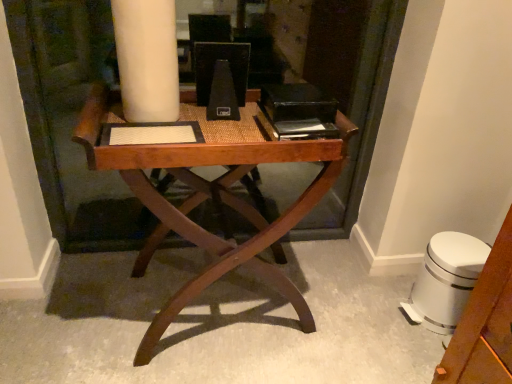
Question: Considering the relative positions of white plastic swivel chair at lower right and wooden desk at center in the image provided, is white plastic swivel chair at lower right behind wooden desk at center?

Choices:
 (A) no
 (B) yes

Answer: (B)

Question: Is wooden desk at center located within white plastic swivel chair at lower right?

Choices:
 (A) no
 (B) yes

Answer: (A)

Question: From the image's perspective, is white plastic swivel chair at lower right beneath wooden desk at center?

Choices:
 (A) yes
 (B) no

Answer: (A)

Question: From the image's perspective, is white plastic swivel chair at lower right on wooden desk at center?

Choices:
 (A) yes
 (B) no

Answer: (B)

Question: Is white plastic swivel chair at lower right thinner than wooden desk at center?

Choices:
 (A) no
 (B) yes

Answer: (B)

Question: Is white plastic swivel chair at lower right looking in the opposite direction of wooden desk at center?

Choices:
 (A) no
 (B) yes

Answer: (A)

Question: Is wooden desk at center aimed at white plastic swivel chair at lower right?

Choices:
 (A) yes
 (B) no

Answer: (B)

Question: Can you confirm if wooden desk at center is thinner than white plastic swivel chair at lower right?

Choices:
 (A) yes
 (B) no

Answer: (B)

Question: From the image's perspective, is wooden desk at center located above white plastic swivel chair at lower right?

Choices:
 (A) yes
 (B) no

Answer: (A)

Question: From the image's perspective, is wooden desk at center beneath white plastic swivel chair at lower right?

Choices:
 (A) yes
 (B) no

Answer: (B)

Question: From a real-world perspective, is wooden desk at center on top of white plastic swivel chair at lower right?

Choices:
 (A) no
 (B) yes

Answer: (B)

Question: Is wooden desk at center positioned before white plastic swivel chair at lower right?

Choices:
 (A) yes
 (B) no

Answer: (A)

Question: From their relative heights in the image, would you say wooden desk at center is taller or shorter than white plastic swivel chair at lower right?

Choices:
 (A) tall
 (B) short

Answer: (A)